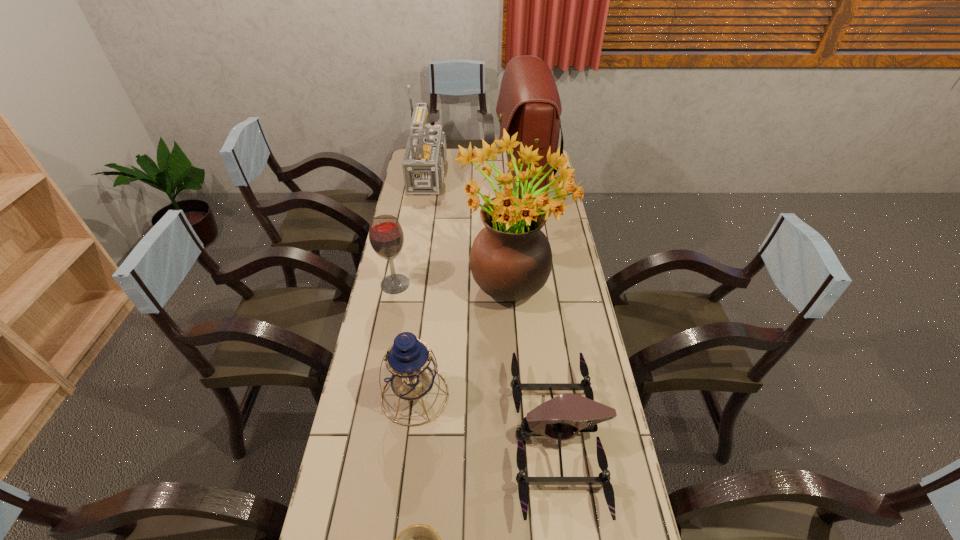
Locate which object is the closest to the third tallest object. Please provide its 2D coordinates. Your answer should be formatted as a tuple, i.e. [(x, y)], where the tuple contains the x and y coordinates of a point satisfying the conditions above.

[(528, 103)]

This screenshot has height=540, width=960. What are the coordinates of `vacant region that satisfies the following two spatial constraints: 1. on the back side of the alcohol; 2. on the right side of the flower arrangement` in the screenshot? It's located at (396, 281).